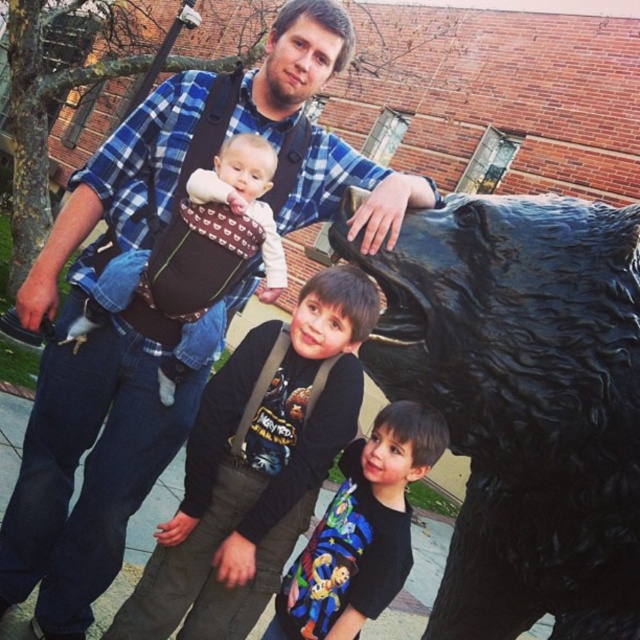
Question: Among these objects, which one is farthest from the camera?

Choices:
 (A) soft brown fabric baby carrier at upper center
 (B) blue plaid shirt at upper center
 (C) dark gray backpack at center

Answer: (A)

Question: Can you confirm if black glossy bear at right is wider than blue plaid shirt at upper center?

Choices:
 (A) no
 (B) yes

Answer: (A)

Question: Among these objects, which one is nearest to the camera?

Choices:
 (A) soft brown fabric baby carrier at upper center
 (B) black t-shirt at center
 (C) blue plaid shirt at upper center

Answer: (B)

Question: Is black glossy bear at right bigger than black t-shirt at center?

Choices:
 (A) no
 (B) yes

Answer: (B)

Question: Can you confirm if dark gray backpack at center is positioned to the left of soft brown fabric baby carrier at upper center?

Choices:
 (A) yes
 (B) no

Answer: (B)

Question: Which point is farther to the camera?

Choices:
 (A) black t-shirt at center
 (B) dark gray backpack at center
 (C) black glossy bear at right

Answer: (B)